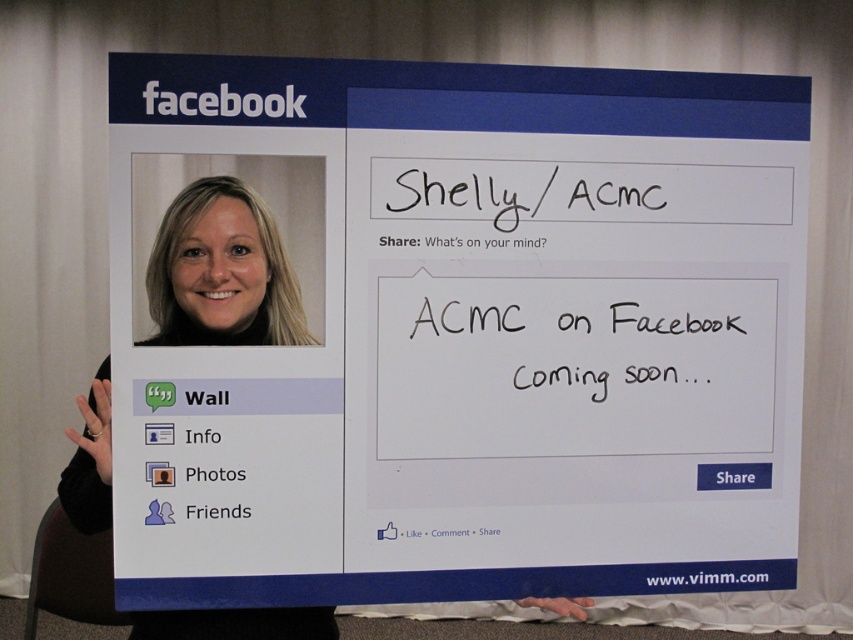
Does white paperboard at center appear over blonde hair at left?

Yes.

What do you see at coordinates (469, 336) in the screenshot? I see `white paperboard at center` at bounding box center [469, 336].

Locate an element on the screen. The image size is (853, 640). white paperboard at center is located at coordinates (469, 336).